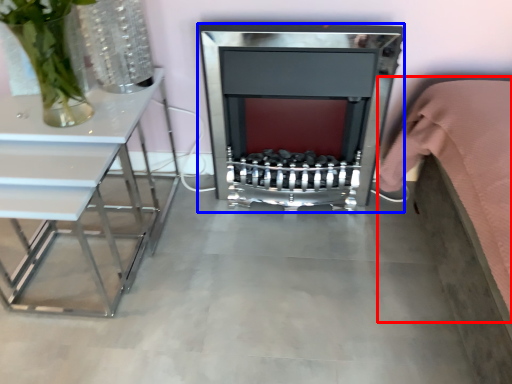
Question: Which point is further to the camera, bed (highlighted by a red box) or fireplace (highlighted by a blue box)?

Choices:
 (A) bed
 (B) fireplace

Answer: (B)